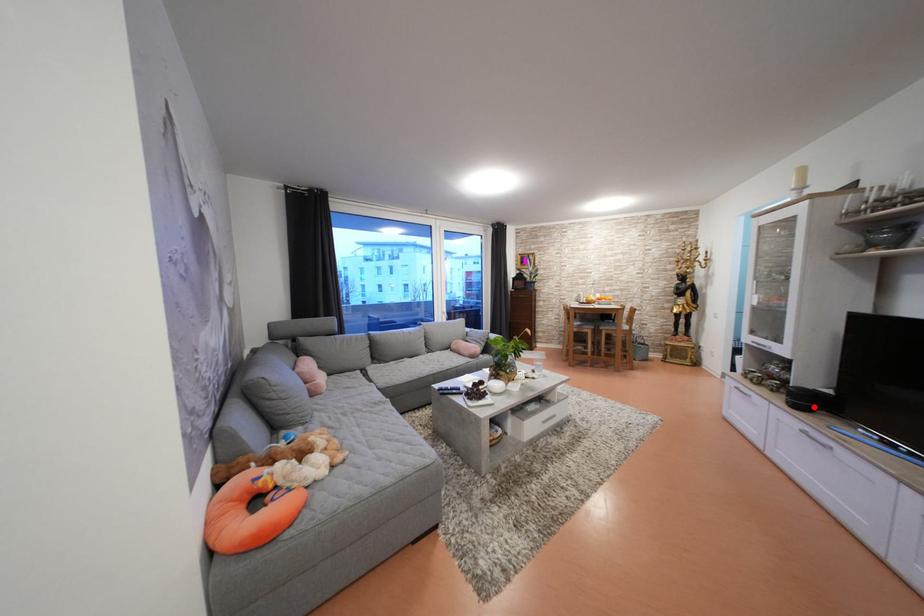
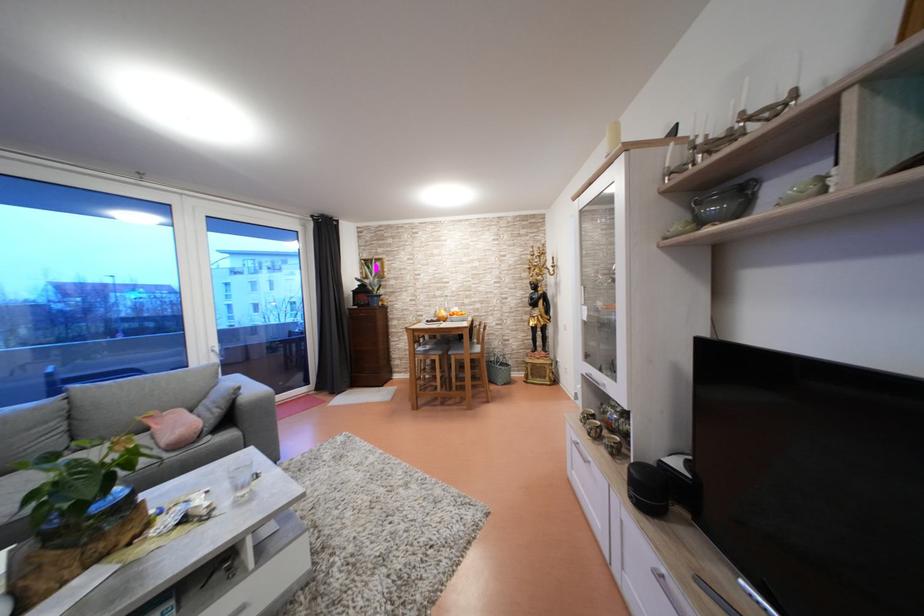
Locate, in the second image, the point that corresponds to the highlighted location in the first image.

(662, 500)